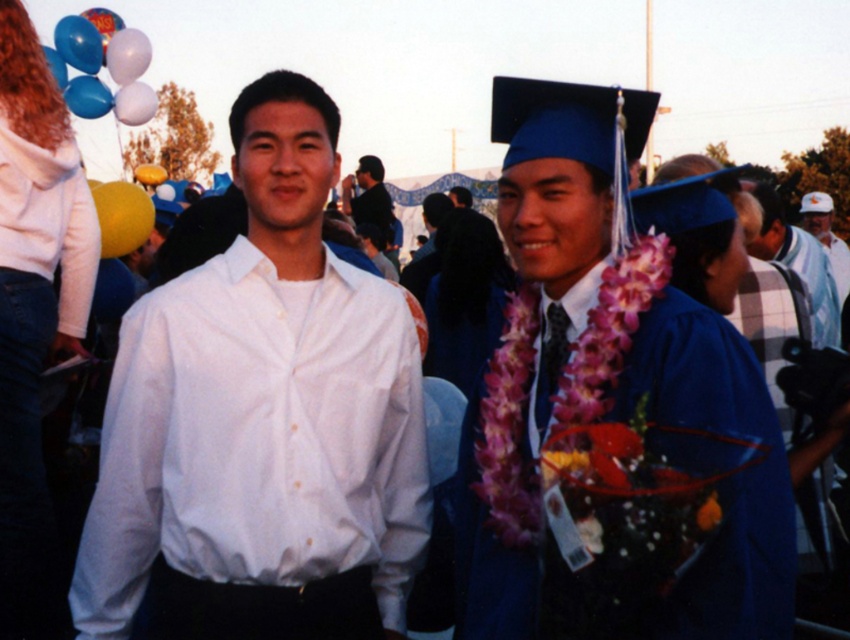
Question: Is matte white balloons at upper left closer to the viewer compared to white matte cap at upper center?

Choices:
 (A) yes
 (B) no

Answer: (A)

Question: Considering the real-world distances, which object is closest to the white smooth shirt at center?

Choices:
 (A) dark blue fabric jacket at center
 (B) white cotton cap at upper right

Answer: (B)

Question: Is white checkered shirt at upper right below white matte cap at upper center?

Choices:
 (A) yes
 (B) no

Answer: (A)

Question: Which object is closer to the camera taking this photo?

Choices:
 (A) matte white balloons at upper left
 (B) white checkered shirt at upper right

Answer: (B)

Question: Can you confirm if white checkered shirt at upper right is positioned to the right of dark blue fabric jacket at center?

Choices:
 (A) no
 (B) yes

Answer: (B)

Question: Which point is farther from the camera taking this photo?

Choices:
 (A) (269, 269)
 (B) (772, 216)

Answer: (B)